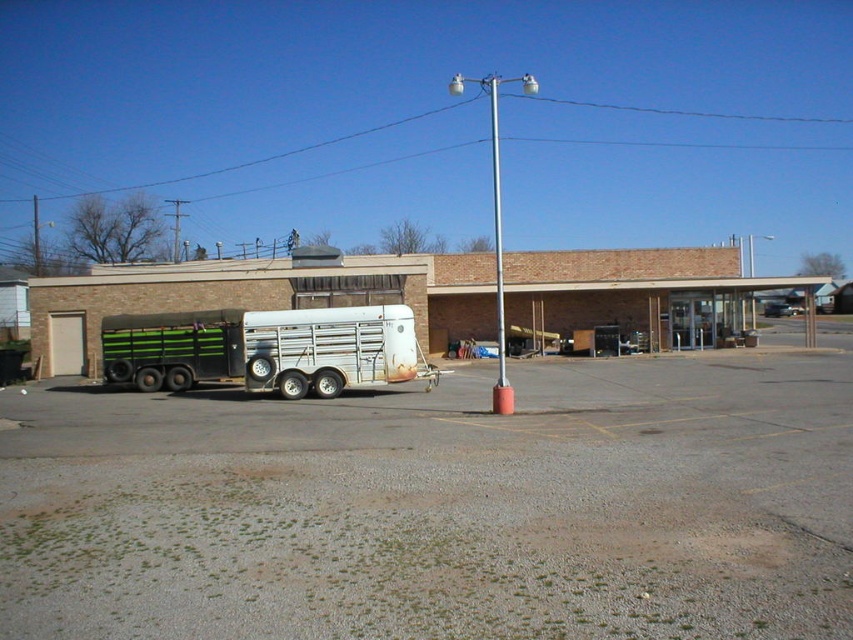
Does gravel at lower left have a larger size compared to red painted metal pole at center?

No.

Does gravel at lower left lie in front of red painted metal pole at center?

Yes, it is.

Locate an element on the screen. gravel at lower left is located at coordinates (440, 506).

Is point (683, 577) closer to viewer compared to point (288, 381)?

Yes, it is in front of point (288, 381).

Between point (440, 456) and point (282, 346), which one is positioned behind?

Point (282, 346)

You are a GUI agent. You are given a task and a screenshot of the screen. Output one action in this format:
    pyautogui.click(x=<x>, y=<y>)
    Task: Click on the gravel at lower left
    The width and height of the screenshot is (853, 640).
    Given the screenshot: What is the action you would take?
    pyautogui.click(x=440, y=506)

Does green striped metal trailer truck at left have a lesser height compared to red painted metal pole at center?

Indeed, green striped metal trailer truck at left has a lesser height compared to red painted metal pole at center.

Can you confirm if green striped metal trailer truck at left is smaller than red painted metal pole at center?

Yes.

Consider the image. Who is more distant from viewer, (234, 372) or (495, 88)?

The point (495, 88) is more distant.

Where is `green striped metal trailer truck at left`? green striped metal trailer truck at left is located at coordinates (265, 349).